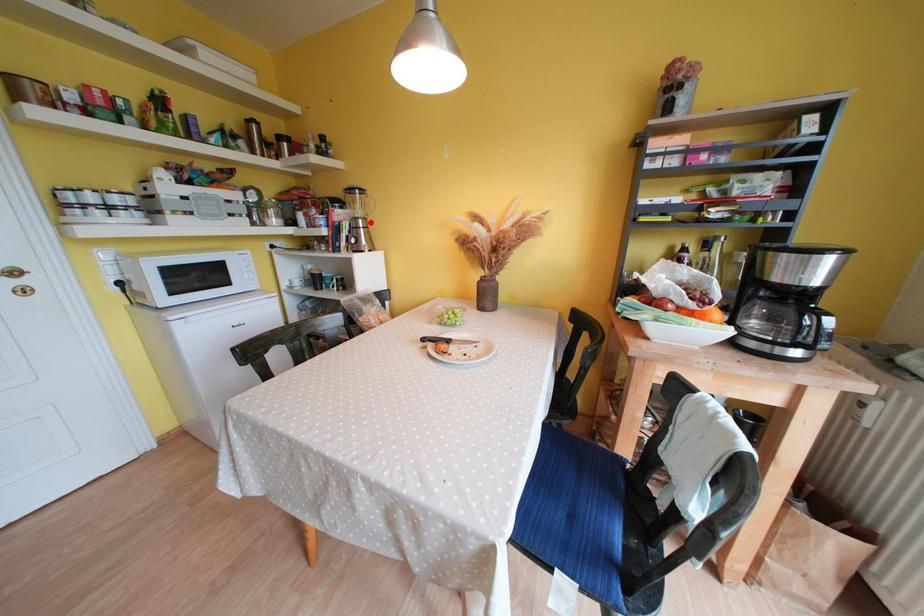
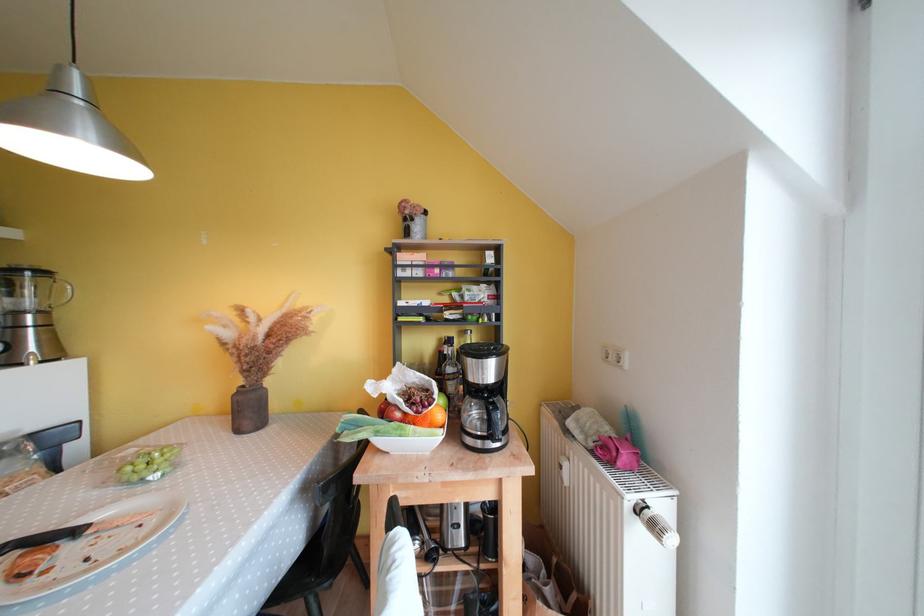
The point at the highlighted location is marked in the first image. Where is the corresponding point in the second image?

(49, 315)